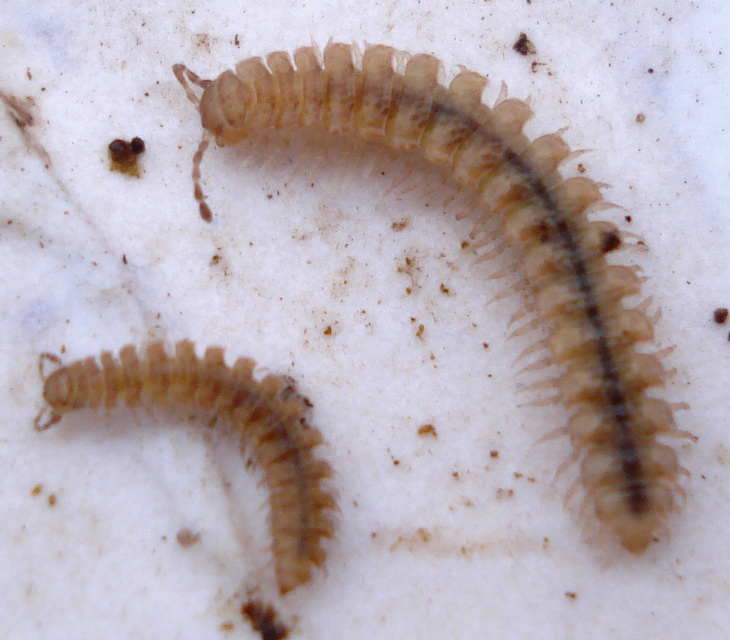
Question: Does translucent beige centipede at center have a larger size compared to translucent beige centipede at lower left?

Choices:
 (A) yes
 (B) no

Answer: (A)

Question: Which point is closer to the camera?

Choices:
 (A) translucent beige centipede at center
 (B) translucent beige centipede at lower left

Answer: (A)

Question: Can you confirm if translucent beige centipede at center is positioned below translucent beige centipede at lower left?

Choices:
 (A) no
 (B) yes

Answer: (A)

Question: Which of the following is the farthest from the observer?

Choices:
 (A) translucent beige centipede at center
 (B) translucent beige centipede at lower left

Answer: (B)

Question: Does translucent beige centipede at center have a larger size compared to translucent beige centipede at lower left?

Choices:
 (A) no
 (B) yes

Answer: (B)